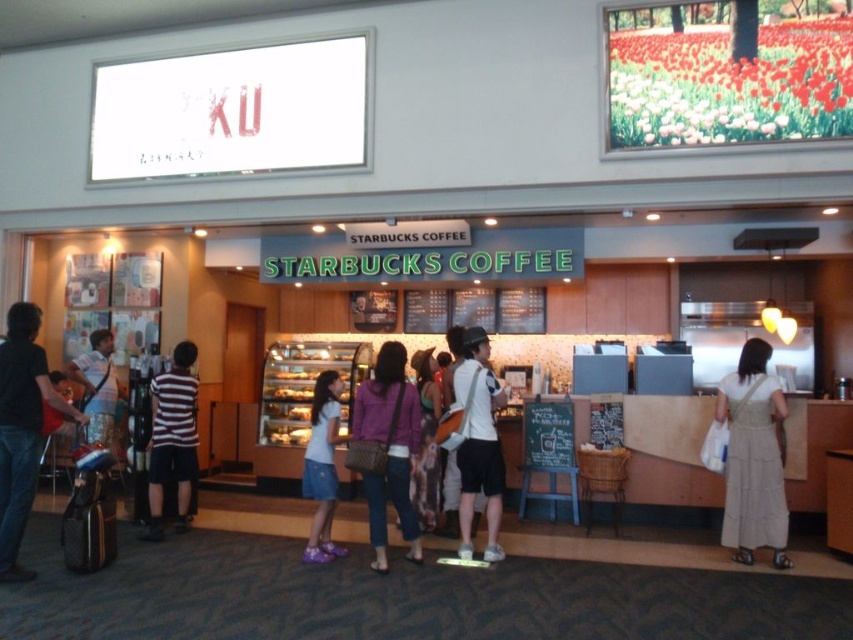
Question: Which object is farther from the camera taking this photo?

Choices:
 (A) light beige dress at lower right
 (B) purple fabric purse at center

Answer: (A)

Question: Is purple fabric purse at center to the right of white denim skirt at center from the viewer's perspective?

Choices:
 (A) no
 (B) yes

Answer: (B)

Question: Among these objects, which one is nearest to the camera?

Choices:
 (A) light beige dress at lower right
 (B) striped fabric shirt at center

Answer: (A)

Question: Which of the following is the farthest from the observer?

Choices:
 (A) (265, 406)
 (B) (474, 412)

Answer: (A)

Question: Is denim jacket at left above golden brown crusty bread at center?

Choices:
 (A) no
 (B) yes

Answer: (B)

Question: Does white matte shirt at center have a greater width compared to golden brown crusty bread at center?

Choices:
 (A) yes
 (B) no

Answer: (B)